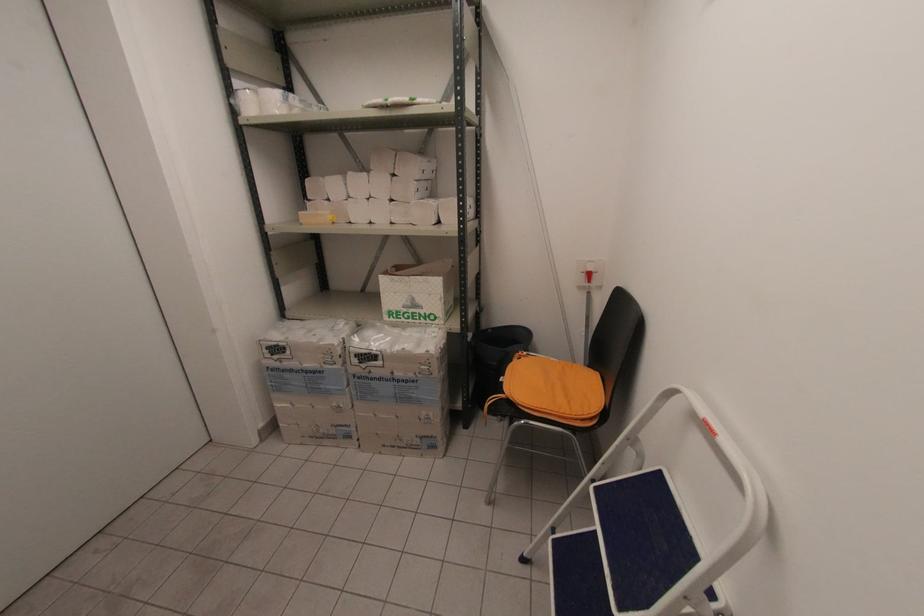
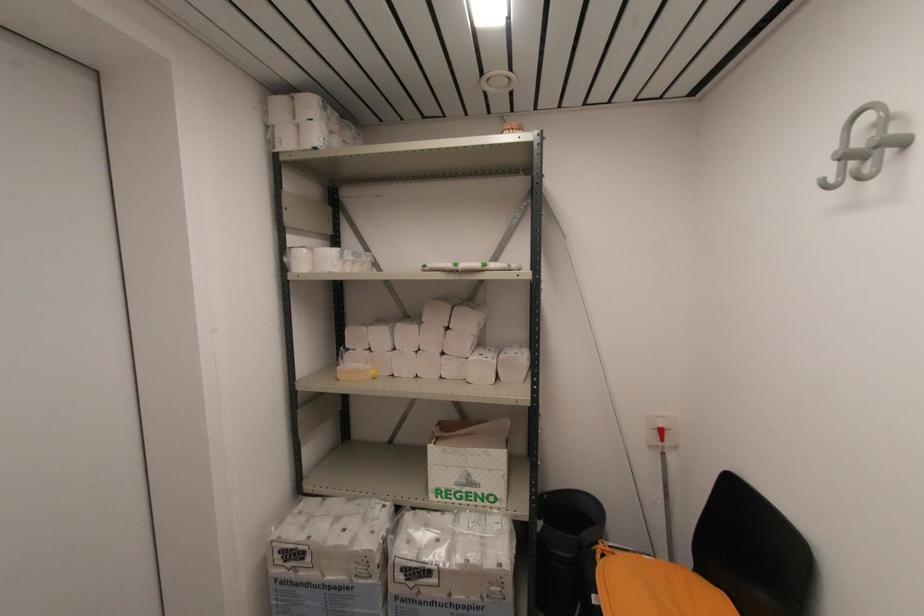
The point at (528, 358) is marked in the first image. Where is the corresponding point in the second image?

(614, 554)